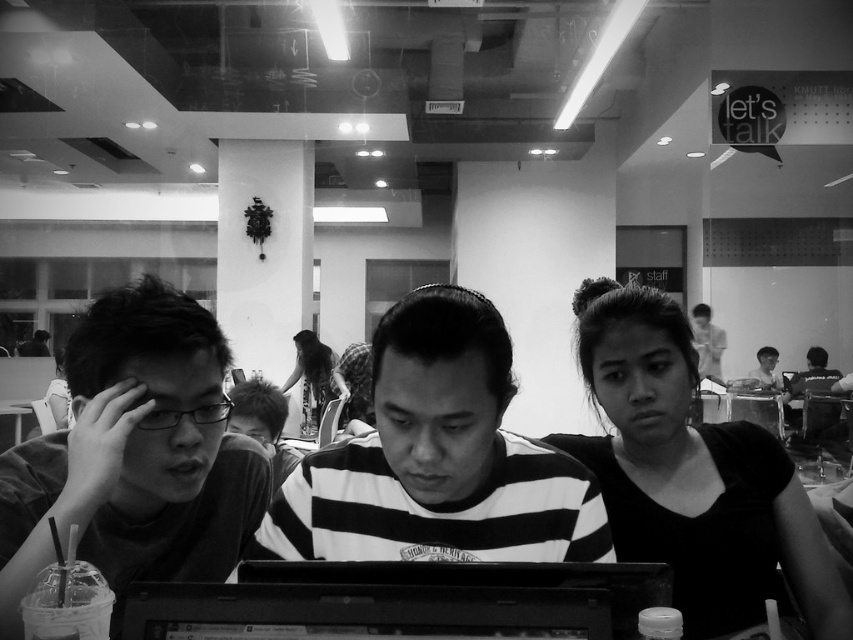
Question: Among these points, which one is nearest to the camera?

Choices:
 (A) (187, 458)
 (B) (230, 388)
 (C) (706, 371)

Answer: (A)

Question: Based on their relative distances, which object is nearer to the smooth black shirt at center?

Choices:
 (A) black matte hair at upper right
 (B) matte black shirt at left

Answer: (A)

Question: Estimate the real-world distances between objects in this image. Which object is farther from the floral fabric dress at center?

Choices:
 (A) smooth wooden table at center
 (B) dark gray shirt at right

Answer: (B)

Question: Is floral fabric dress at center wider than smooth skin man at upper right?

Choices:
 (A) no
 (B) yes

Answer: (A)

Question: Is black plastic laptop at center closer to camera compared to floral fabric dress at center?

Choices:
 (A) yes
 (B) no

Answer: (A)

Question: Does black matte hair at upper right appear under dark gray shirt at right?

Choices:
 (A) no
 (B) yes

Answer: (A)